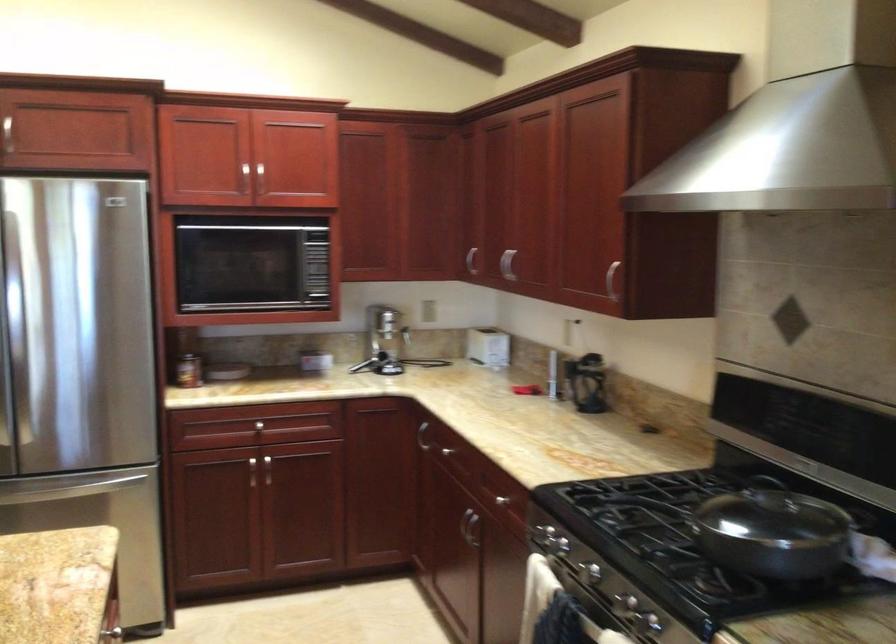
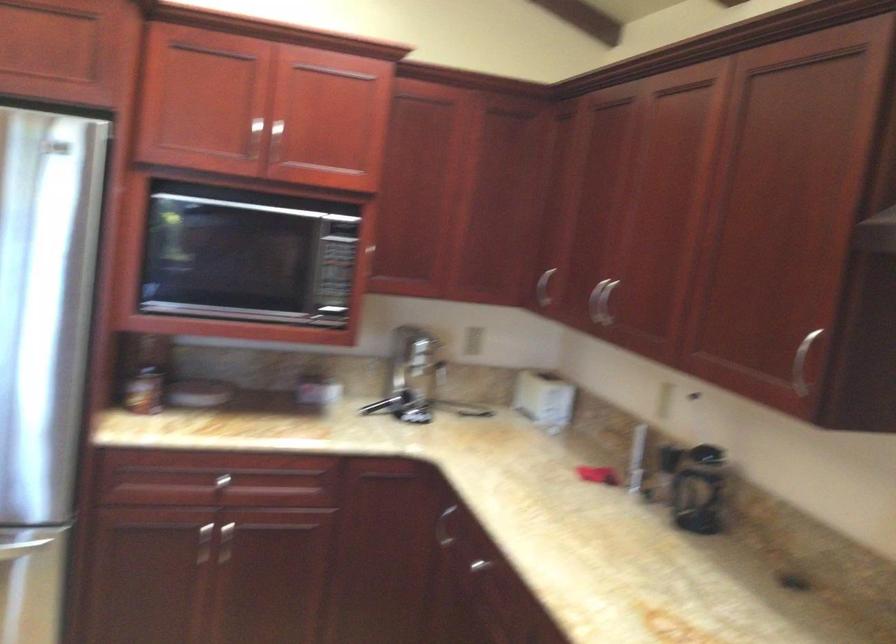
The point at (455, 450) is marked in the first image. Where is the corresponding point in the second image?

(495, 567)